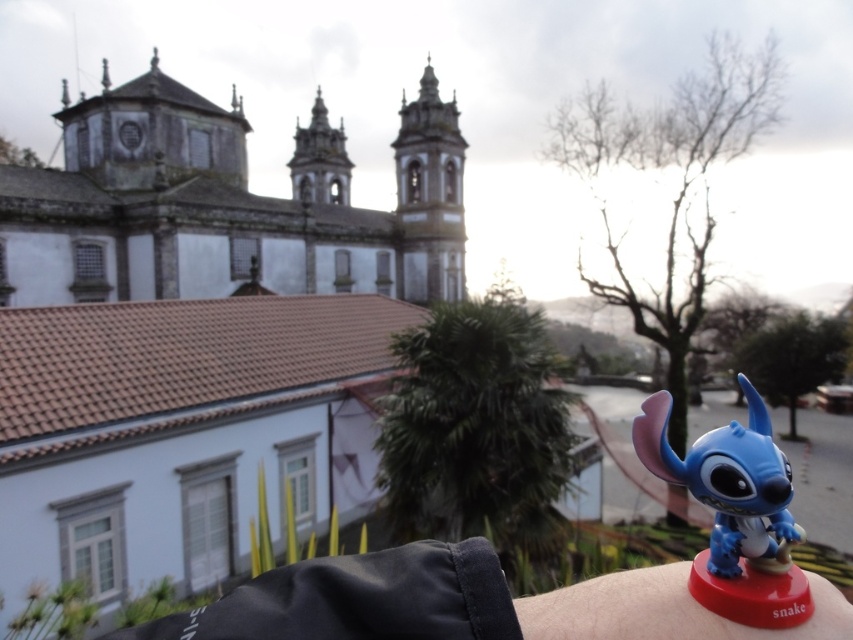
You are organizing a toy display and need to place the blue matte toy at upper right and the blue plastic toy at lower right on a shelf. Which toy requires more horizontal space on the shelf?

The blue matte toy at upper right requires more horizontal space on the shelf because its width surpasses that of the blue plastic toy at lower right.

You are holding a blue toy and want to place it on the red base labeled snake. Which blue toy, the blue matte toy at lower right or the blue plastic toy at lower right, is closer to the red base labeled snake?

The blue matte toy at lower right is closer to the red base labeled snake because it is further to the viewer than the blue plastic toy at lower right.